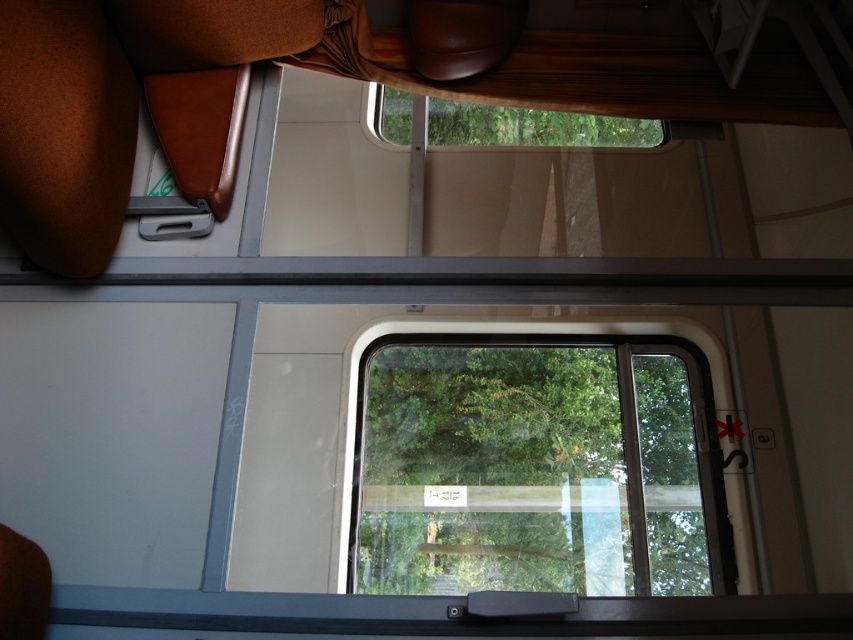
Question: From the image, what is the correct spatial relationship of transparent glass window at center in relation to transparent glass window at upper center?

Choices:
 (A) left
 (B) right

Answer: (B)

Question: Which of the following is the closest to the observer?

Choices:
 (A) transparent glass window at upper center
 (B) transparent glass window at center

Answer: (B)

Question: Does transparent glass window at center appear over transparent glass window at upper center?

Choices:
 (A) no
 (B) yes

Answer: (A)

Question: Which object appears closest to the camera in this image?

Choices:
 (A) transparent glass window at upper center
 (B) transparent glass window at center

Answer: (B)

Question: Is transparent glass window at center positioned behind transparent glass window at upper center?

Choices:
 (A) no
 (B) yes

Answer: (A)